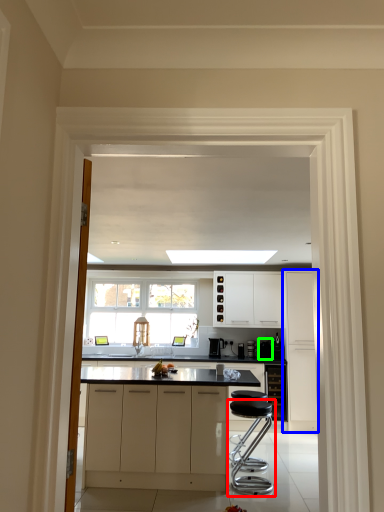
Question: Which object is positioned closest to stool (highlighted by a red box)? Select from cabinetry (highlighted by a blue box) and appliance (highlighted by a green box).

Choices:
 (A) cabinetry
 (B) appliance

Answer: (A)